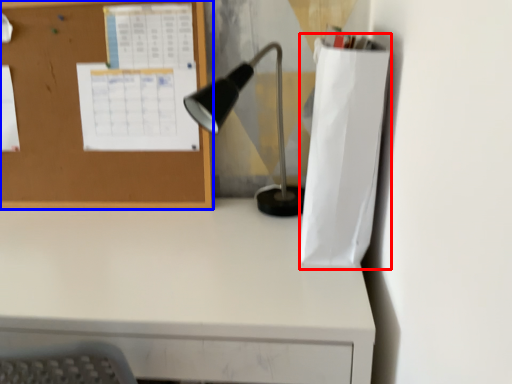
Question: Among these objects, which one is nearest to the camera, paper bag (highlighted by a red box) or bulletin board (highlighted by a blue box)?

Choices:
 (A) paper bag
 (B) bulletin board

Answer: (A)